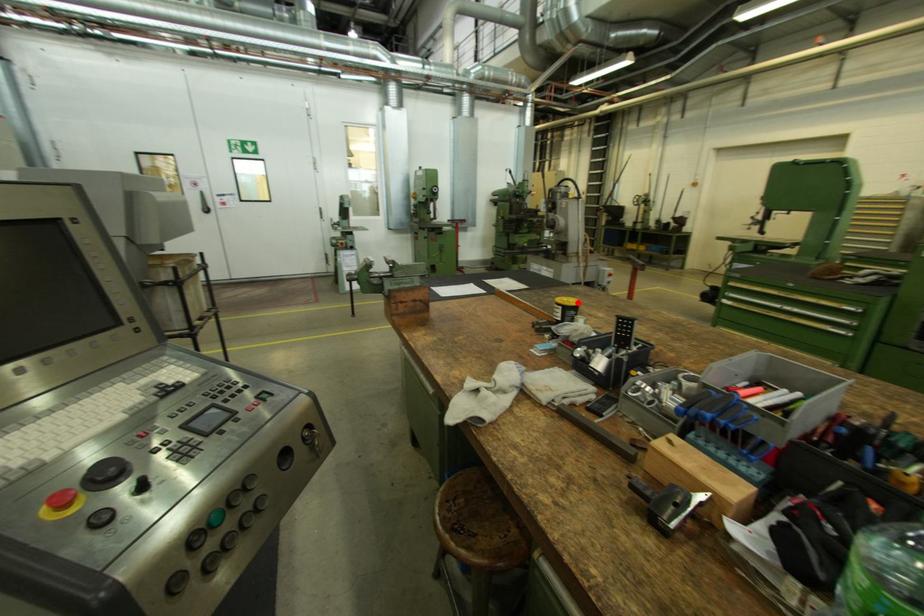
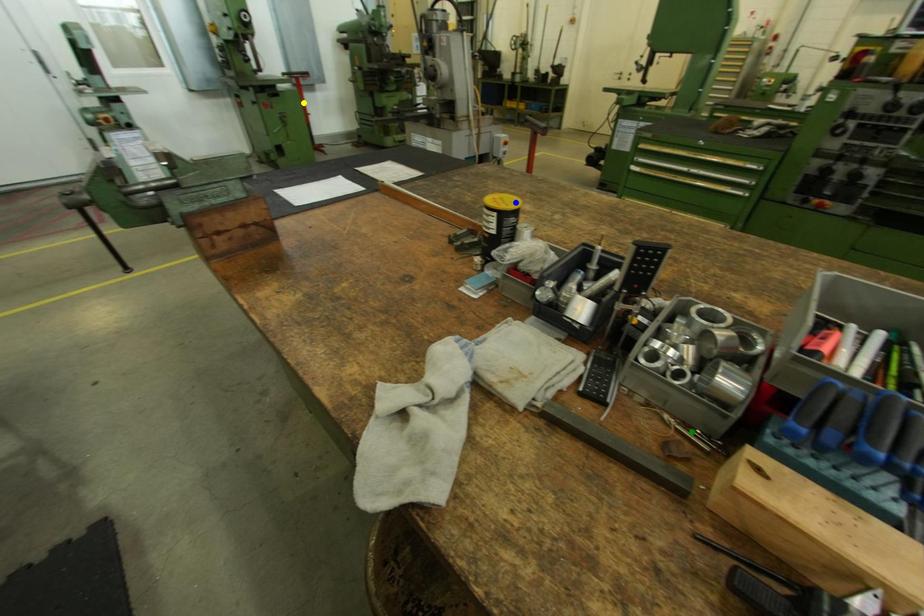
Question: I am providing you with two images of the same scene from different viewpoints. A red point is marked on the first image. You are given multiple points on the second image. Which spot in image 2 lines up with the point in image 1?

Choices:
 (A) yellow point
 (B) blue point
 (C) green point

Answer: (B)